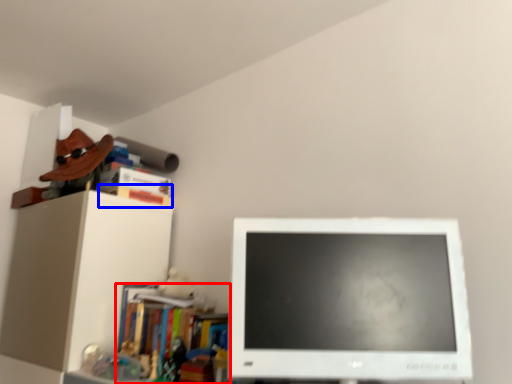
Question: Which of the following is the closest to the observer, book (highlighted by a red box) or book (highlighted by a blue box)?

Choices:
 (A) book
 (B) book

Answer: (A)